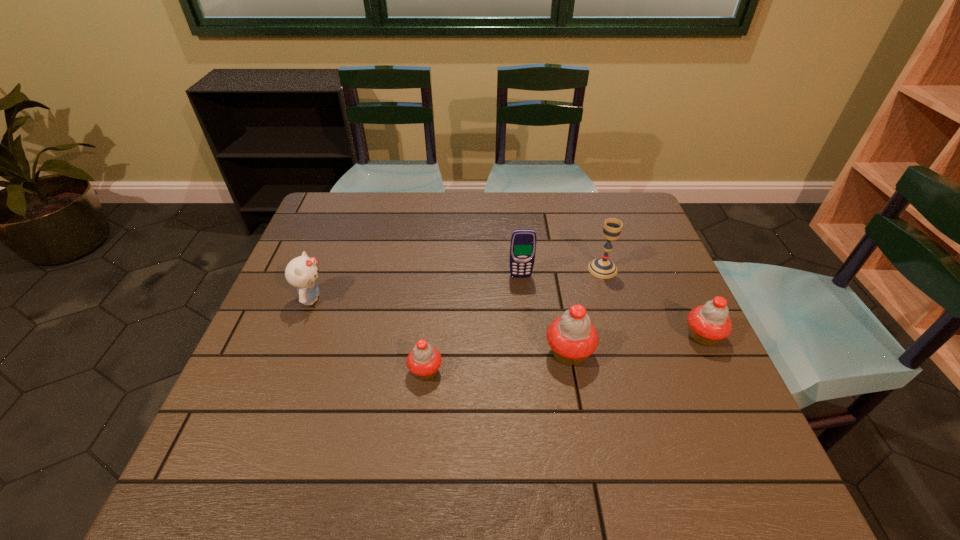
Identify the location of free space located on the back of the leftmost cupcake. The height and width of the screenshot is (540, 960). (430, 333).

Identify the location of vacant space located 0.380m on the back of the second cupcake from left to right. This screenshot has height=540, width=960. (548, 237).

Where is `free space located 0.070m on the left of the rightmost object`? This screenshot has height=540, width=960. free space located 0.070m on the left of the rightmost object is located at coordinates (653, 336).

This screenshot has width=960, height=540. Find the location of `free space located on the front of the fifth object from left to right`. free space located on the front of the fifth object from left to right is located at coordinates (622, 333).

You are a GUI agent. You are given a task and a screenshot of the screen. Output one action in this format:
    pyautogui.click(x=<x>, y=<y>)
    Task: Click on the vacant space located on the front-facing side of the third farthest object
    
    Given the screenshot: What is the action you would take?
    pyautogui.click(x=392, y=299)

Locate an element on the screen. The image size is (960, 540). vacant region located on the front-facing side of the cellular telephone is located at coordinates (534, 406).

Identify the location of object located at the left edge. The width and height of the screenshot is (960, 540). (301, 272).

Identify the location of cupcake at the right edge. The image size is (960, 540). (707, 324).

In order to click on chalice at the right edge in this screenshot , I will do `click(604, 268)`.

At what (x,y) coordinates should I click in order to perform the action: click on vacant space at the far edge of the desktop. Please return your answer as a coordinate pair (x, y). Looking at the image, I should click on (395, 209).